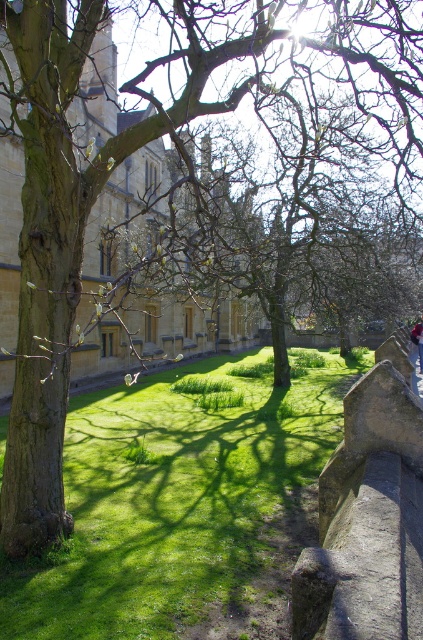
Question: Does green grass at center have a larger size compared to denim jacket at lower right?

Choices:
 (A) no
 (B) yes

Answer: (A)

Question: Which point appears closest to the camera in this image?

Choices:
 (A) (422, 340)
 (B) (107, 460)

Answer: (B)

Question: Is green grass at center closer to camera compared to denim jacket at lower right?

Choices:
 (A) yes
 (B) no

Answer: (A)

Question: Among these objects, which one is nearest to the camera?

Choices:
 (A) green grass at center
 (B) denim jacket at lower right

Answer: (A)

Question: Observing the image, what is the correct spatial positioning of green grass at center in reference to denim jacket at lower right?

Choices:
 (A) right
 (B) left

Answer: (B)